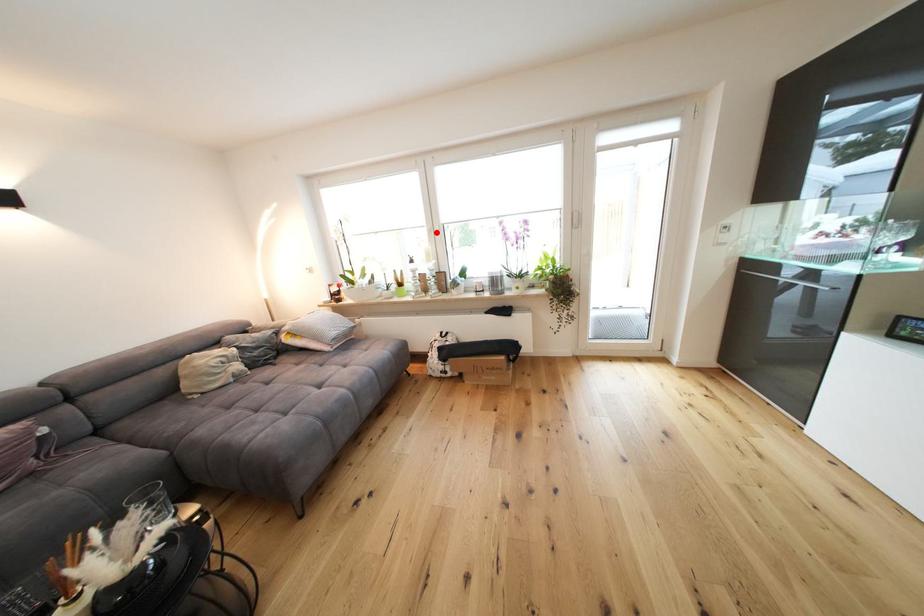
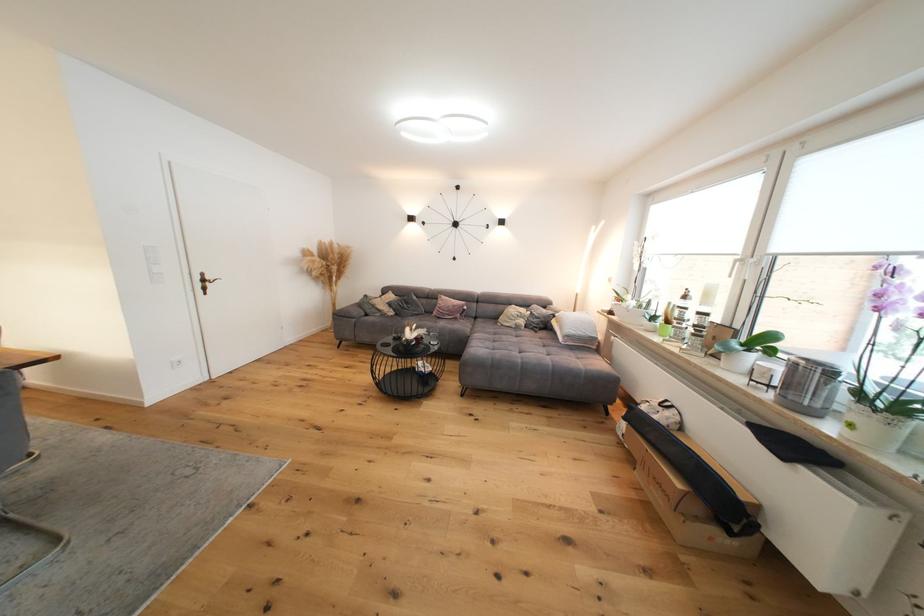
Locate, in the second image, the point that corresponds to the highlighted location in the first image.

(744, 262)